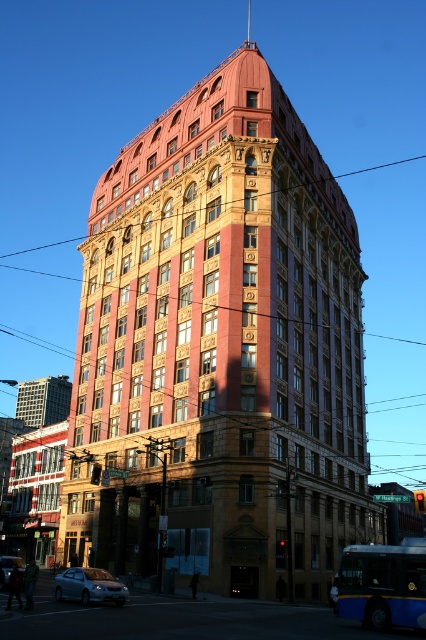
Can you confirm if satin silver sedan at lower left is positioned above silver metallic sedan at lower left?

Indeed, satin silver sedan at lower left is positioned over silver metallic sedan at lower left.

Does satin silver sedan at lower left lie behind silver metallic sedan at lower left?

No, it is not.

Which is behind, point (68, 577) or point (5, 570)?

The point (5, 570) is behind.

Locate an element on the screen. The width and height of the screenshot is (426, 640). satin silver sedan at lower left is located at coordinates (89, 586).

Which is more to the left, blue metallic bus at lower right or satin silver sedan at lower left?

satin silver sedan at lower left

Is blue metallic bus at lower right positioned in front of satin silver sedan at lower left?

Yes, blue metallic bus at lower right is closer to the viewer.

Between point (380, 595) and point (85, 580), which one is positioned in front?

Point (380, 595) is more forward.

Locate an element on the screen. This screenshot has width=426, height=640. blue metallic bus at lower right is located at coordinates (383, 584).

Which is above, blue metallic bus at lower right or silver metallic sedan at lower left?

blue metallic bus at lower right

Is blue metallic bus at lower right positioned before silver metallic sedan at lower left?

Yes, it is.

Locate an element on the screen. The height and width of the screenshot is (640, 426). blue metallic bus at lower right is located at coordinates (383, 584).